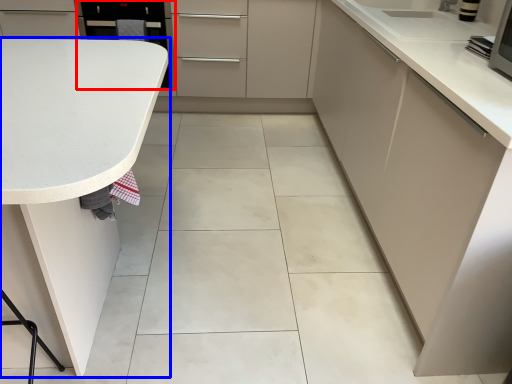
Question: Which point is further to the camera, appliance (highlighted by a red box) or countertop (highlighted by a blue box)?

Choices:
 (A) appliance
 (B) countertop

Answer: (A)